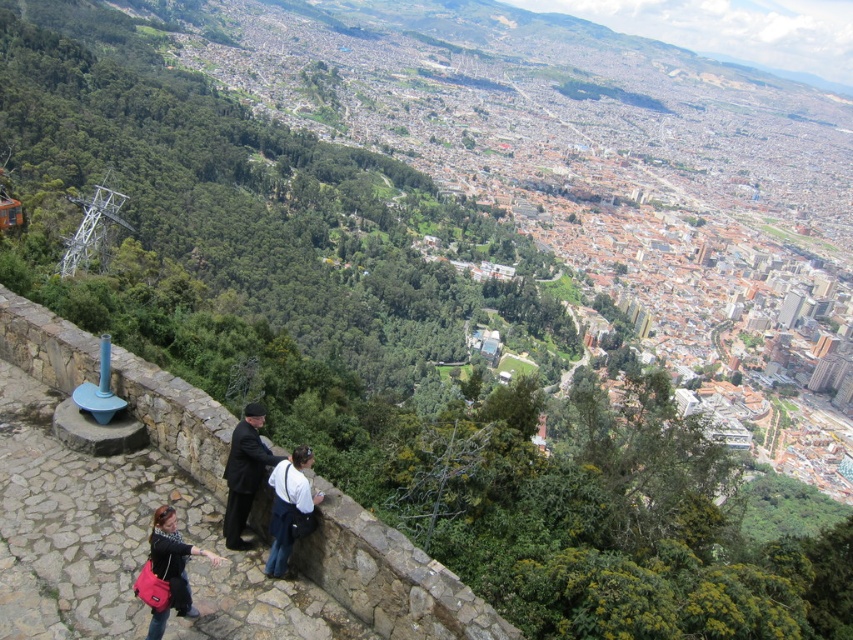
Is white shirt at center further to the viewer compared to matte black jacket at lower left?

Yes.

Where is `white shirt at center`? white shirt at center is located at coordinates (288, 506).

Where is `white shirt at center`? white shirt at center is located at coordinates (288, 506).

Is point (184, 381) positioned after point (238, 433)?

Yes, point (184, 381) is behind point (238, 433).

Between stone at lower left and dark suit at center, which one has less height?

dark suit at center

Is point (302, 550) positioned behind point (239, 467)?

No, it is not.

The width and height of the screenshot is (853, 640). In order to click on stone at lower left in this screenshot , I will do `click(390, 577)`.

Who is taller, dark suit at center or matte black jacket at lower left?

Standing taller between the two is dark suit at center.

How much distance is there between dark suit at center and matte black jacket at lower left?

The distance of dark suit at center from matte black jacket at lower left is 29.66 feet.

Locate an element on the screen. The image size is (853, 640). dark suit at center is located at coordinates (244, 472).